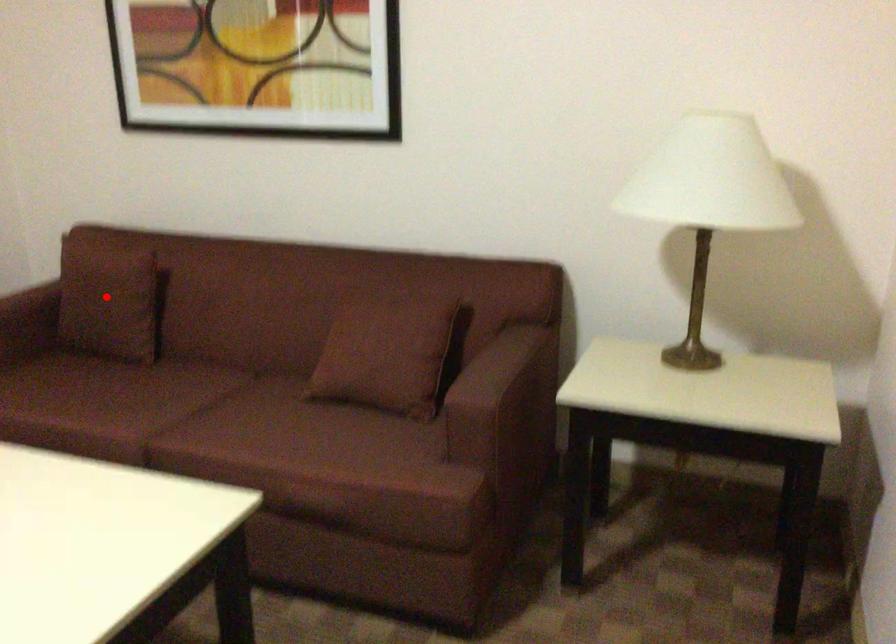
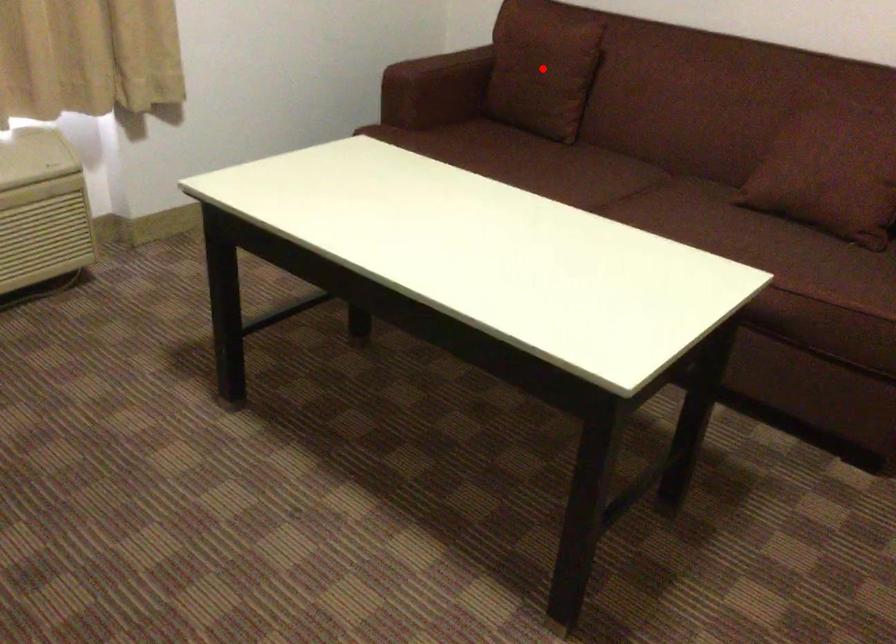
I am providing you with two images of the same scene from different viewpoints. A red point is marked on the first image and another point is marked on the second image. Are the points marked in image1 and image2 representing the same 3D position?

Yes